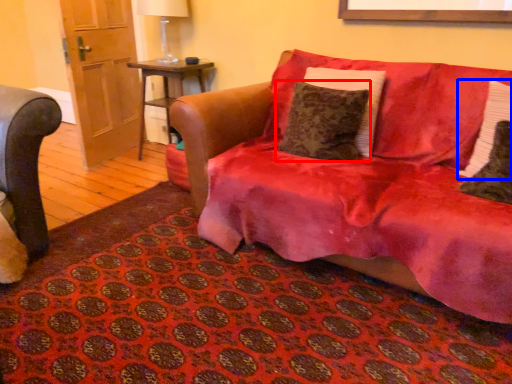
Question: Which point is further to the camera, pillow (highlighted by a red box) or pillow (highlighted by a blue box)?

Choices:
 (A) pillow
 (B) pillow

Answer: (A)